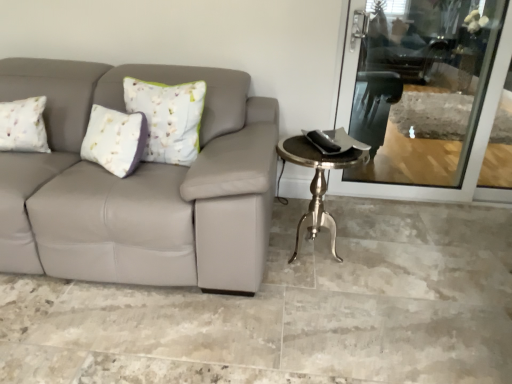
Image resolution: width=512 pixels, height=384 pixels. I want to click on free spot to the right of silver metallic table at right, so click(x=388, y=265).